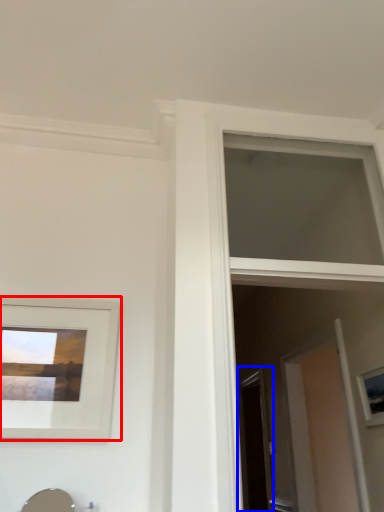
Question: Which object appears farthest to the camera in this image, picture frame (highlighted by a red box) or screen door (highlighted by a blue box)?

Choices:
 (A) picture frame
 (B) screen door

Answer: (B)